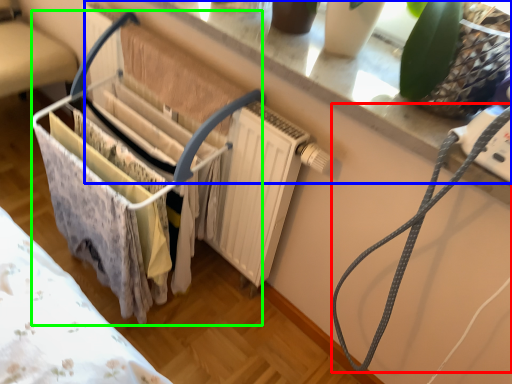
Question: Considering the real-world distances, which object is farthest from string (highlighted by a red box)? window sill (highlighted by a blue box) or baby carriage (highlighted by a green box)?

Choices:
 (A) window sill
 (B) baby carriage

Answer: (B)